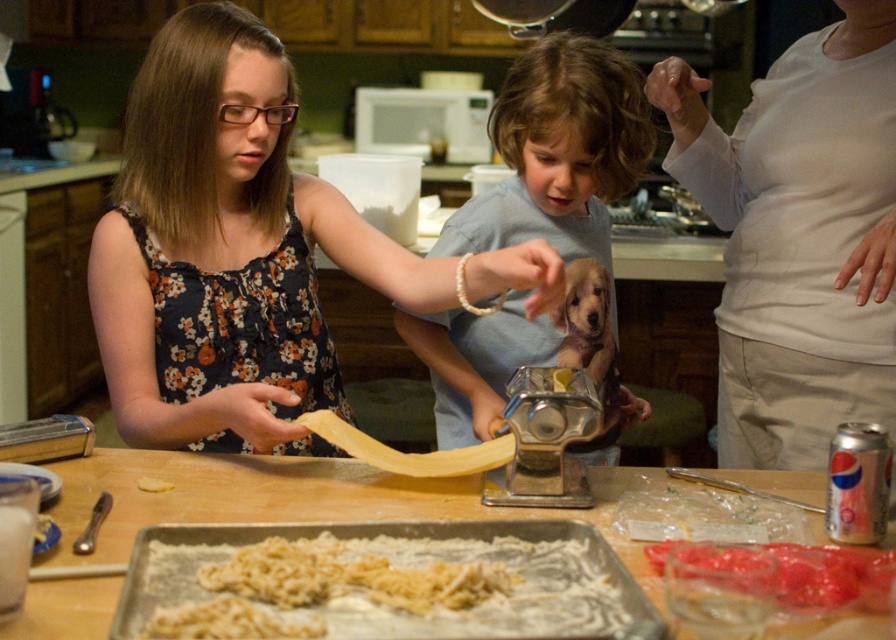
Question: Which point appears closest to the camera in this image?

Choices:
 (A) (213, 589)
 (B) (570, 189)
 (C) (165, 486)
 (D) (735, 289)

Answer: (A)

Question: Among these points, which one is farthest from the camera?

Choices:
 (A) (586, 134)
 (B) (192, 252)

Answer: (B)

Question: Considering the real-world distances, which object is farthest from the light blue shirt at center?

Choices:
 (A) translucent plastic container at lower right
 (B) yellow matte pasta at center

Answer: (B)

Question: Can you confirm if floral fabric dress at upper left is positioned below white crumbly pasta at center?

Choices:
 (A) yes
 (B) no

Answer: (B)

Question: Is floral fabric dress at upper left further to the viewer compared to light blue shirt at center?

Choices:
 (A) yes
 (B) no

Answer: (B)

Question: Observing the image, what is the correct spatial positioning of light blue shirt at center in reference to white crumbly pasta at center?

Choices:
 (A) below
 (B) above

Answer: (B)